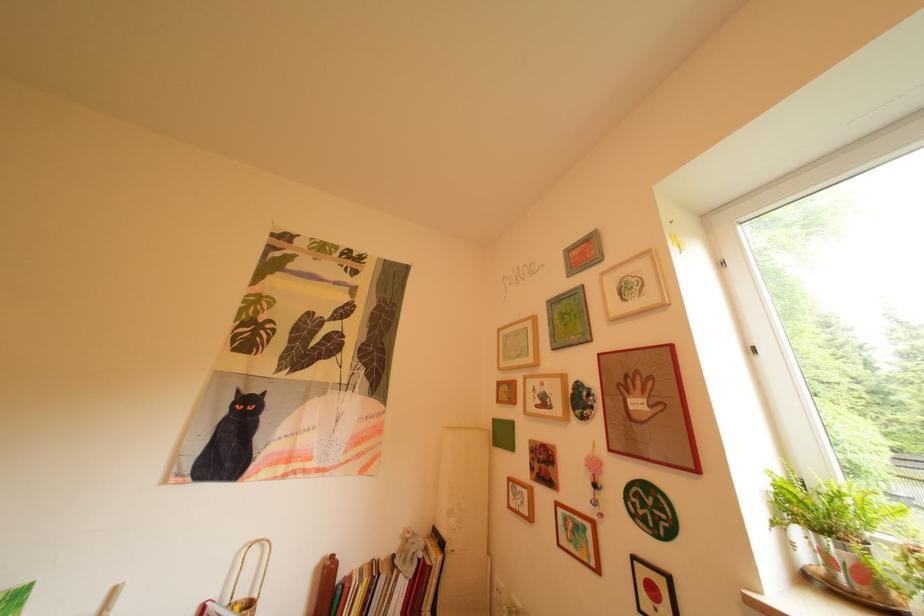
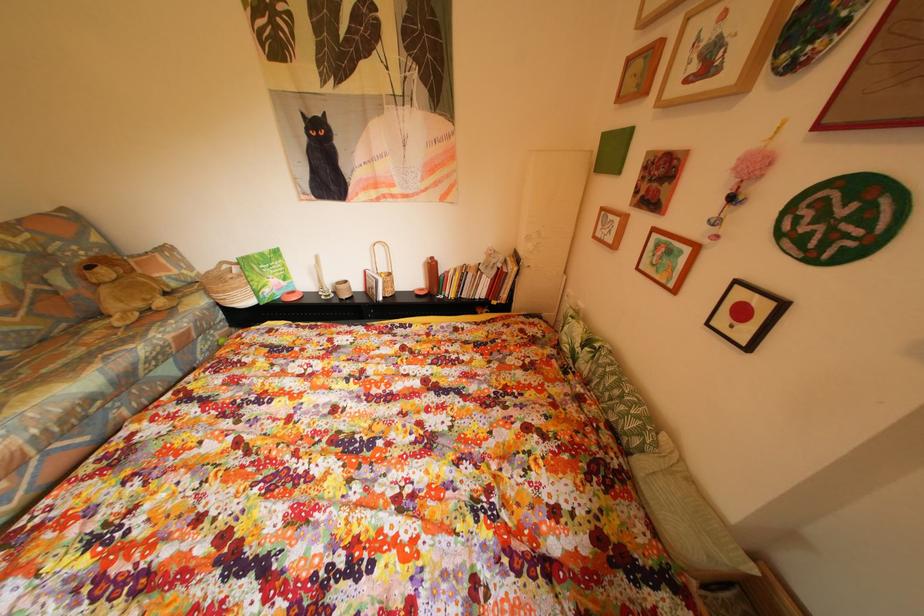
The images are taken continuously from a first-person perspective. In which direction is your viewpoint rotating?

The camera rotated toward left-down.